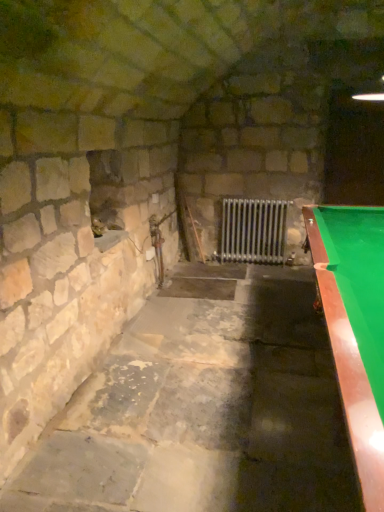
Question: Considering the relative sizes of green felt pool table at right and metallic silver radiator at center in the image provided, is green felt pool table at right smaller than metallic silver radiator at center?

Choices:
 (A) no
 (B) yes

Answer: (A)

Question: Is green felt pool table at right aimed at metallic silver radiator at center?

Choices:
 (A) no
 (B) yes

Answer: (A)

Question: From the image's perspective, would you say green felt pool table at right is positioned over metallic silver radiator at center?

Choices:
 (A) no
 (B) yes

Answer: (A)

Question: Is green felt pool table at right to the left of metallic silver radiator at center from the viewer's perspective?

Choices:
 (A) yes
 (B) no

Answer: (B)

Question: From the image's perspective, is green felt pool table at right below metallic silver radiator at center?

Choices:
 (A) no
 (B) yes

Answer: (B)

Question: Is green felt pool table at right thinner than metallic silver radiator at center?

Choices:
 (A) no
 (B) yes

Answer: (A)

Question: Does metallic silver radiator at center turn towards green felt pool table at right?

Choices:
 (A) yes
 (B) no

Answer: (A)

Question: Is metallic silver radiator at center outside of green felt pool table at right?

Choices:
 (A) no
 (B) yes

Answer: (B)

Question: From the image's perspective, is metallic silver radiator at center below green felt pool table at right?

Choices:
 (A) no
 (B) yes

Answer: (A)

Question: Considering the relative sizes of metallic silver radiator at center and green felt pool table at right in the image provided, is metallic silver radiator at center shorter than green felt pool table at right?

Choices:
 (A) yes
 (B) no

Answer: (A)

Question: Does metallic silver radiator at center contain green felt pool table at right?

Choices:
 (A) no
 (B) yes

Answer: (A)

Question: Does metallic silver radiator at center have a greater width compared to green felt pool table at right?

Choices:
 (A) no
 (B) yes

Answer: (A)

Question: In terms of size, does metallic silver radiator at center appear bigger or smaller than green felt pool table at right?

Choices:
 (A) small
 (B) big

Answer: (A)